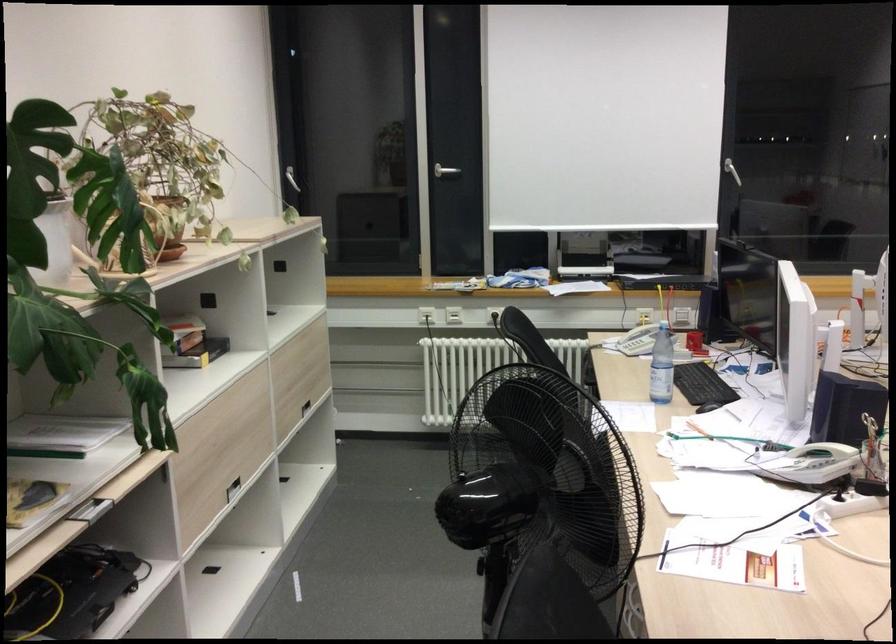
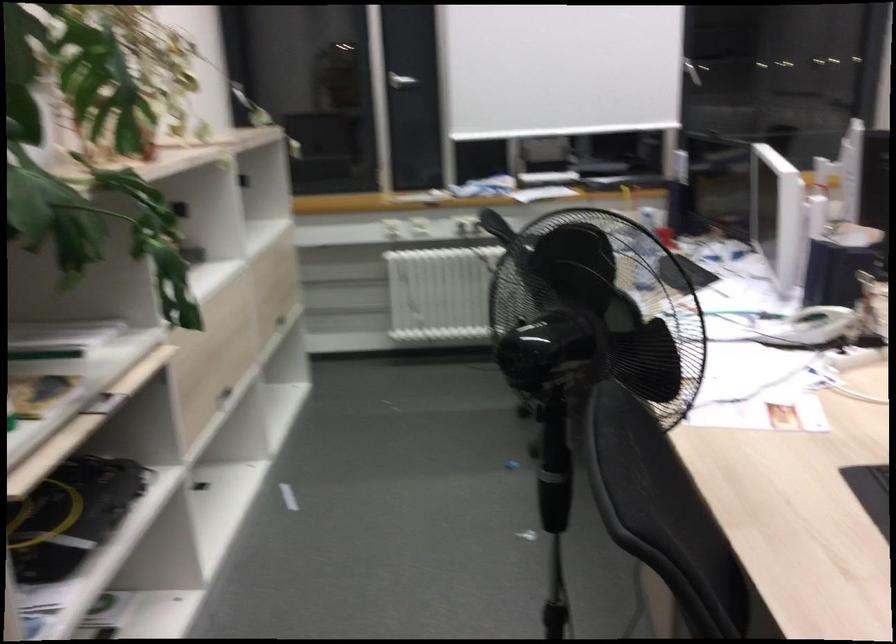
Question: Based on the continuous images, in which direction is the camera rotating? Reply with the corresponding letter.

Choices:
 (A) Left
 (B) Right
 (C) Up
 (D) Down

Answer: (B)